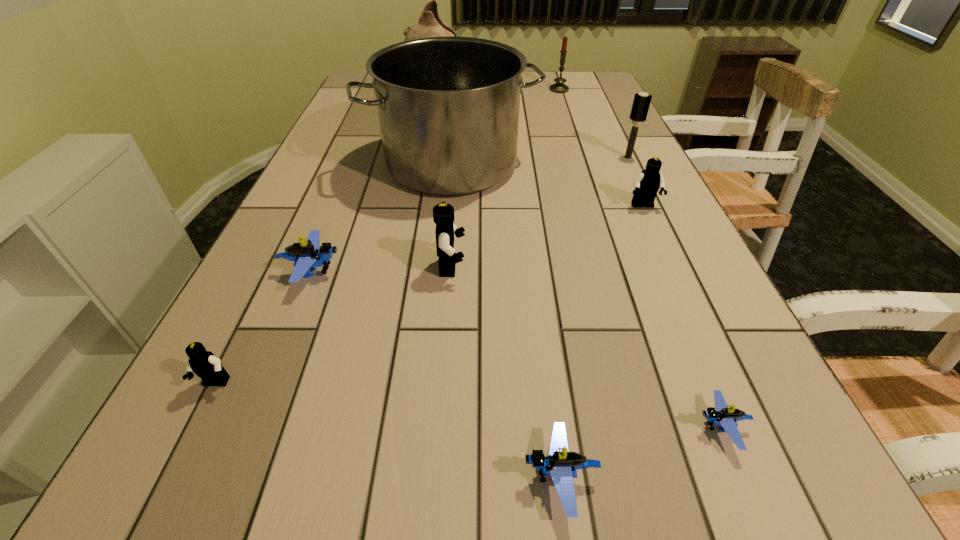
Where is `free space located on the front-facing side of the shortest Lego`? The width and height of the screenshot is (960, 540). free space located on the front-facing side of the shortest Lego is located at coordinates (461, 428).

Image resolution: width=960 pixels, height=540 pixels. What are the coordinates of `pottery that is at the far edge` in the screenshot? It's located at (430, 24).

I want to click on candle that is positioned at the far edge, so click(559, 87).

At what (x,y) coordinates should I click in order to perform the action: click on object at the near edge. Please return your answer as a coordinate pair (x, y). This screenshot has height=540, width=960. Looking at the image, I should click on (562, 465).

Identify the location of saucepan that is at the left edge. (448, 107).

Find the location of `hairbrush present at the right edge`. hairbrush present at the right edge is located at coordinates (641, 103).

The height and width of the screenshot is (540, 960). What are the coordinates of `candle that is positioned at the right edge` in the screenshot? It's located at (559, 87).

You are a GUI agent. You are given a task and a screenshot of the screen. Output one action in this format:
    pyautogui.click(x=<x>, y=<y>)
    Task: Click on the object that is at the far right corner
    The width and height of the screenshot is (960, 540).
    Given the screenshot: What is the action you would take?
    pyautogui.click(x=559, y=87)

This screenshot has height=540, width=960. In the image, there is a desktop. Find the location of `vacant space at the left edge`. vacant space at the left edge is located at coordinates (334, 136).

Find the location of `vacant area at the right edge of the desktop`. vacant area at the right edge of the desktop is located at coordinates (645, 252).